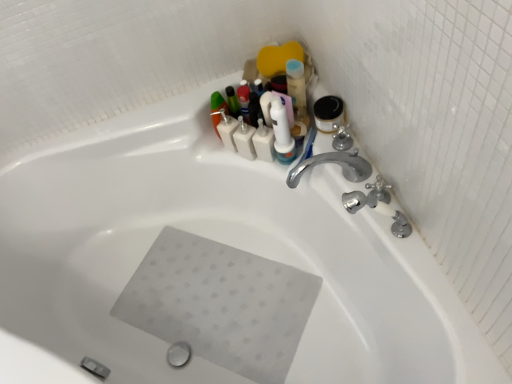
This screenshot has height=384, width=512. Describe the element at coordinates (244, 140) in the screenshot. I see `white matte bottles at upper center, marked as the first toiletry in a left-to-right arrangement` at that location.

Find the location of `white plastic toothbrush at upper center, the 2th toiletry when ordered from left to right`. white plastic toothbrush at upper center, the 2th toiletry when ordered from left to right is located at coordinates (264, 142).

Does satin nickel faucet at upper right, the 1th plumbing fixture when ordered from back to front, touch white plastic toothbrush at upper center, the 2th toiletry when ordered from left to right?

They are not placed beside each other.

Who is more distant, satin nickel faucet at upper right, which is the 2th plumbing fixture from front to back, or white plastic toothbrush at upper center, the 2th toiletry when ordered from left to right?

Positioned behind is white plastic toothbrush at upper center, the 2th toiletry when ordered from left to right.

Which of these two, satin nickel faucet at upper right, which is the 2th plumbing fixture from front to back, or white plastic toothbrush at upper center, the 2th toiletry when ordered from left to right, is bigger?

white plastic toothbrush at upper center, the 2th toiletry when ordered from left to right.

From the image's perspective, which one is positioned higher, satin nickel faucet at upper right, the 1th plumbing fixture when ordered from back to front, or white plastic toothbrush at upper center, which is the first toiletry from right to left?

white plastic toothbrush at upper center, which is the first toiletry from right to left, from the image's perspective.

Is white plastic toothbrush at upper center, the 2th toiletry when ordered from left to right, taller or shorter than white matte bottles at upper center, which appears as the 2th toiletry when viewed from the right?

Considering their sizes, white plastic toothbrush at upper center, the 2th toiletry when ordered from left to right, has more height than white matte bottles at upper center, which appears as the 2th toiletry when viewed from the right.

Consider the image. Is white matte bottles at upper center, marked as the first toiletry in a left-to-right arrangement, at the back of white plastic toothbrush at upper center, which is the first toiletry from right to left?

That's not correct — white plastic toothbrush at upper center, which is the first toiletry from right to left, is not looking away from white matte bottles at upper center, marked as the first toiletry in a left-to-right arrangement.

Locate an element on the screen. This screenshot has width=512, height=384. toiletry above the white plastic toothbrush at upper center, the 2th toiletry when ordered from left to right (from the image's perspective) is located at coordinates (244, 140).

Which object is wider, white plastic toothbrush at upper center, the 2th toiletry when ordered from left to right, or white matte bottles at upper center, which appears as the 2th toiletry when viewed from the right?

white matte bottles at upper center, which appears as the 2th toiletry when viewed from the right, is wider.

Is point (380, 181) closer or farther from the camera than point (243, 153)?

Point (380, 181) appears to be closer to the viewer than point (243, 153).

How many degrees apart are the facing directions of satin nickel faucet at upper right, the 1th plumbing fixture when ordered from back to front, and white matte bottles at upper center, which appears as the 2th toiletry when viewed from the right?

The angle between the facing direction of satin nickel faucet at upper right, the 1th plumbing fixture when ordered from back to front, and the facing direction of white matte bottles at upper center, which appears as the 2th toiletry when viewed from the right, is 52.6 degrees.

Consider the image. Considering the sizes of satin nickel faucet at upper right, which is the 2th plumbing fixture from front to back, and white matte bottles at upper center, which appears as the 2th toiletry when viewed from the right, in the image, is satin nickel faucet at upper right, which is the 2th plumbing fixture from front to back, wider or thinner than white matte bottles at upper center, which appears as the 2th toiletry when viewed from the right,?

In the image, satin nickel faucet at upper right, which is the 2th plumbing fixture from front to back, appears to be more narrow than white matte bottles at upper center, which appears as the 2th toiletry when viewed from the right.

Would you say white matte bottles at upper center, which appears as the 2th toiletry when viewed from the right, is part of satin nickel faucet at upper right, which is the 2th plumbing fixture from front to back,'s contents?

No.

Which of these two, white matte bottles at upper center, which appears as the 2th toiletry when viewed from the right, or white plastic toothbrush at upper center, which is the first toiletry from right to left, is wider?

With larger width is white matte bottles at upper center, which appears as the 2th toiletry when viewed from the right.

Between white matte bottles at upper center, which appears as the 2th toiletry when viewed from the right, and white plastic toothbrush at upper center, the 2th toiletry when ordered from left to right, which one has less height?

Standing shorter between the two is white matte bottles at upper center, which appears as the 2th toiletry when viewed from the right.

Considering the sizes of objects white matte bottles at upper center, marked as the first toiletry in a left-to-right arrangement, and white plastic toothbrush at upper center, the 2th toiletry when ordered from left to right, in the image provided, who is bigger, white matte bottles at upper center, marked as the first toiletry in a left-to-right arrangement, or white plastic toothbrush at upper center, the 2th toiletry when ordered from left to right,?

white matte bottles at upper center, marked as the first toiletry in a left-to-right arrangement, is bigger.

Is white matte bottles at upper center, marked as the first toiletry in a left-to-right arrangement, not near white plastic toothbrush at upper center, the 2th toiletry when ordered from left to right?

No, there isn't a large distance between white matte bottles at upper center, marked as the first toiletry in a left-to-right arrangement, and white plastic toothbrush at upper center, the 2th toiletry when ordered from left to right.

Based on their sizes in the image, would you say silver metallic faucet at upper right, the second plumbing fixture positioned from the back, is bigger or smaller than white plastic toothbrush at upper center, the 2th toiletry when ordered from left to right?

silver metallic faucet at upper right, the second plumbing fixture positioned from the back, is bigger than white plastic toothbrush at upper center, the 2th toiletry when ordered from left to right.

Does silver metallic faucet at upper right, the second plumbing fixture positioned from the back, have a greater height compared to white plastic toothbrush at upper center, the 2th toiletry when ordered from left to right?

Indeed, silver metallic faucet at upper right, the second plumbing fixture positioned from the back, has a greater height compared to white plastic toothbrush at upper center, the 2th toiletry when ordered from left to right.

Is point (373, 185) more distant than point (256, 154)?

No, (373, 185) is in front of (256, 154).

Between point (410, 226) and point (245, 153), which one is positioned in front?

The point (410, 226) is more forward.

Considering the relative positions of silver metallic faucet at upper right, the second plumbing fixture positioned from the back, and white matte bottles at upper center, marked as the first toiletry in a left-to-right arrangement, in the image provided, is silver metallic faucet at upper right, the second plumbing fixture positioned from the back, to the left of white matte bottles at upper center, marked as the first toiletry in a left-to-right arrangement, from the viewer's perspective?

Incorrect, silver metallic faucet at upper right, the second plumbing fixture positioned from the back, is not on the left side of white matte bottles at upper center, marked as the first toiletry in a left-to-right arrangement.

Would you say white matte bottles at upper center, marked as the first toiletry in a left-to-right arrangement, is inside or outside satin nickel faucet at upper right, which is the 2th plumbing fixture from front to back?

A: white matte bottles at upper center, marked as the first toiletry in a left-to-right arrangement, is outside satin nickel faucet at upper right, which is the 2th plumbing fixture from front to back.

From the picture: Is the position of white matte bottles at upper center, marked as the first toiletry in a left-to-right arrangement, less distant than that of satin nickel faucet at upper right, the 1th plumbing fixture when ordered from back to front?

No, white matte bottles at upper center, marked as the first toiletry in a left-to-right arrangement, is further to the viewer.

Is white matte bottles at upper center, which appears as the 2th toiletry when viewed from the right, facing away from satin nickel faucet at upper right, which is the 2th plumbing fixture from front to back?

No, satin nickel faucet at upper right, which is the 2th plumbing fixture from front to back, is not at the back of white matte bottles at upper center, which appears as the 2th toiletry when viewed from the right.

How many degrees apart are the facing directions of white matte bottles at upper center, marked as the first toiletry in a left-to-right arrangement, and satin nickel faucet at upper right, which is the 2th plumbing fixture from front to back?

52.6 degrees.

This screenshot has height=384, width=512. What are the coordinates of `toiletry that is the 1st object located above the satin nickel faucet at upper right, the 1th plumbing fixture when ordered from back to front (from the image's perspective)` in the screenshot? It's located at (264, 142).

Locate an element on the screen. toiletry that is below the white matte bottles at upper center, which appears as the 2th toiletry when viewed from the right (from the image's perspective) is located at coordinates (264, 142).

From the image, which object appears to be farther from satin nickel faucet at upper right, the 1th plumbing fixture when ordered from back to front, white plastic toothbrush at upper center, the 2th toiletry when ordered from left to right, or white matte bottles at upper center, marked as the first toiletry in a left-to-right arrangement?

white matte bottles at upper center, marked as the first toiletry in a left-to-right arrangement, is further to satin nickel faucet at upper right, the 1th plumbing fixture when ordered from back to front.

Which object lies further to the anchor point white matte bottles at upper center, marked as the first toiletry in a left-to-right arrangement, silver metallic faucet at upper right, which ranks as the first plumbing fixture in front-to-back order, or satin nickel faucet at upper right, the 1th plumbing fixture when ordered from back to front?

The object further to white matte bottles at upper center, marked as the first toiletry in a left-to-right arrangement, is silver metallic faucet at upper right, which ranks as the first plumbing fixture in front-to-back order.

Based on their spatial positions, is white matte bottles at upper center, which appears as the 2th toiletry when viewed from the right, or silver metallic faucet at upper right, the second plumbing fixture positioned from the back, closer to white plastic toothbrush at upper center, the 2th toiletry when ordered from left to right?

white matte bottles at upper center, which appears as the 2th toiletry when viewed from the right.

When comparing their distances from satin nickel faucet at upper right, the 1th plumbing fixture when ordered from back to front, does white matte bottles at upper center, marked as the first toiletry in a left-to-right arrangement, or silver metallic faucet at upper right, the second plumbing fixture positioned from the back, seem closer?

The object closer to satin nickel faucet at upper right, the 1th plumbing fixture when ordered from back to front, is silver metallic faucet at upper right, the second plumbing fixture positioned from the back.

Which object lies further to the anchor point silver metallic faucet at upper right, which ranks as the first plumbing fixture in front-to-back order, white plastic toothbrush at upper center, which is the first toiletry from right to left, or satin nickel faucet at upper right, which is the 2th plumbing fixture from front to back?

white plastic toothbrush at upper center, which is the first toiletry from right to left.

Which object lies further to the anchor point silver metallic faucet at upper right, which ranks as the first plumbing fixture in front-to-back order, white matte bottles at upper center, marked as the first toiletry in a left-to-right arrangement, or white plastic toothbrush at upper center, the 2th toiletry when ordered from left to right?

Among the two, white matte bottles at upper center, marked as the first toiletry in a left-to-right arrangement, is located further to silver metallic faucet at upper right, which ranks as the first plumbing fixture in front-to-back order.

Looking at the image, which one is located closer to silver metallic faucet at upper right, which ranks as the first plumbing fixture in front-to-back order, white plastic toothbrush at upper center, the 2th toiletry when ordered from left to right, or white matte bottles at upper center, which appears as the 2th toiletry when viewed from the right?

Based on the image, white plastic toothbrush at upper center, the 2th toiletry when ordered from left to right, appears to be nearer to silver metallic faucet at upper right, which ranks as the first plumbing fixture in front-to-back order.

From the image, which object appears to be nearer to silver metallic faucet at upper right, which ranks as the first plumbing fixture in front-to-back order, satin nickel faucet at upper right, the 1th plumbing fixture when ordered from back to front, or white matte bottles at upper center, which appears as the 2th toiletry when viewed from the right?

The object closer to silver metallic faucet at upper right, which ranks as the first plumbing fixture in front-to-back order, is satin nickel faucet at upper right, the 1th plumbing fixture when ordered from back to front.

Where is `toiletry located between white matte bottles at upper center, which appears as the 2th toiletry when viewed from the right, and satin nickel faucet at upper right, which is the 2th plumbing fixture from front to back, in the left-right direction`? The width and height of the screenshot is (512, 384). toiletry located between white matte bottles at upper center, which appears as the 2th toiletry when viewed from the right, and satin nickel faucet at upper right, which is the 2th plumbing fixture from front to back, in the left-right direction is located at coordinates (264, 142).

Where is `toiletry positioned between silver metallic faucet at upper right, the second plumbing fixture positioned from the back, and white matte bottles at upper center, which appears as the 2th toiletry when viewed from the right, from near to far`? toiletry positioned between silver metallic faucet at upper right, the second plumbing fixture positioned from the back, and white matte bottles at upper center, which appears as the 2th toiletry when viewed from the right, from near to far is located at coordinates (264, 142).

What are the coordinates of `plumbing fixture positioned between silver metallic faucet at upper right, which ranks as the first plumbing fixture in front-to-back order, and white matte bottles at upper center, marked as the first toiletry in a left-to-right arrangement, from near to far` in the screenshot? It's located at (378, 192).

Where is `plumbing fixture positioned between silver metallic faucet at upper right, which ranks as the first plumbing fixture in front-to-back order, and white plastic toothbrush at upper center, the 2th toiletry when ordered from left to right, from near to far`? The width and height of the screenshot is (512, 384). plumbing fixture positioned between silver metallic faucet at upper right, which ranks as the first plumbing fixture in front-to-back order, and white plastic toothbrush at upper center, the 2th toiletry when ordered from left to right, from near to far is located at coordinates (378, 192).